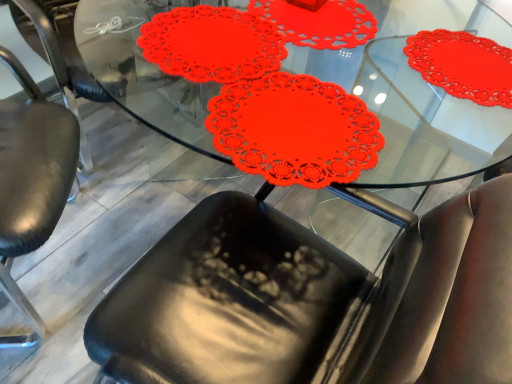
Question: From a real-world perspective, is red paper doily at center below black leather chair at lower left?

Choices:
 (A) no
 (B) yes

Answer: (A)

Question: From the image's perspective, does red paper doily at center appear lower than black leather chair at lower left?

Choices:
 (A) no
 (B) yes

Answer: (B)

Question: Is red paper doily at center bigger than black leather chair at lower left?

Choices:
 (A) no
 (B) yes

Answer: (B)

Question: From a real-world perspective, is red paper doily at center positioned over black leather chair at lower left based on gravity?

Choices:
 (A) no
 (B) yes

Answer: (B)

Question: Are red paper doily at center and black leather chair at lower left making contact?

Choices:
 (A) no
 (B) yes

Answer: (A)

Question: Is red paper doily at center closer to camera compared to black leather chair at lower left?

Choices:
 (A) no
 (B) yes

Answer: (B)

Question: Is black leather chair at lower left at the left side of red paper doily at center?

Choices:
 (A) no
 (B) yes

Answer: (B)

Question: Is the depth of black leather chair at lower left greater than that of red paper doily at center?

Choices:
 (A) yes
 (B) no

Answer: (A)

Question: Does black leather chair at lower left appear on the right side of red paper doily at center?

Choices:
 (A) no
 (B) yes

Answer: (A)

Question: Is black leather chair at lower left closer to the viewer compared to red paper doily at center?

Choices:
 (A) no
 (B) yes

Answer: (A)

Question: From a real-world perspective, is black leather chair at lower left located higher than red paper doily at center?

Choices:
 (A) yes
 (B) no

Answer: (B)

Question: From the image's perspective, is black leather chair at lower left on red paper doily at center?

Choices:
 (A) yes
 (B) no

Answer: (A)

Question: Is red paper doily at center wider or thinner than black leather chair at lower left?

Choices:
 (A) wide
 (B) thin

Answer: (A)